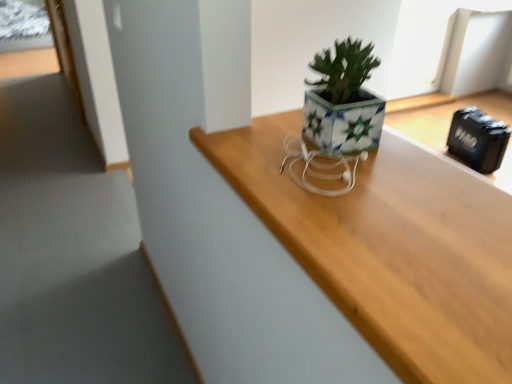
The width and height of the screenshot is (512, 384). What do you see at coordinates (391, 249) in the screenshot?
I see `wooden table at center` at bounding box center [391, 249].

Looking at this image, what is the approximate height of wooden table at center?

1.43 inches.

Identify the location of wooden table at center. (391, 249).

Identify the location of wooden table at center. pos(391,249).